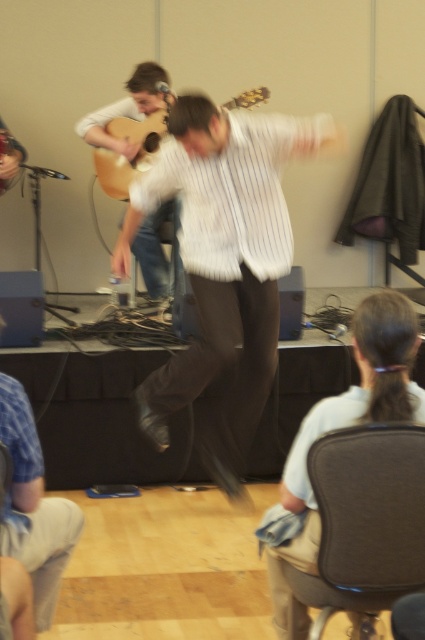
You are a photographer setting up for a photoshoot in this room. You need to place a small tripod between the black fabric chair at lower right and the blue denim shorts at lower left. Based on their positions, where should you place the tripod?

The black fabric chair at lower right is positioned under the blue denim shorts at lower left, so the tripod should be placed between them horizontally, ensuring it is not obstructed by either object.